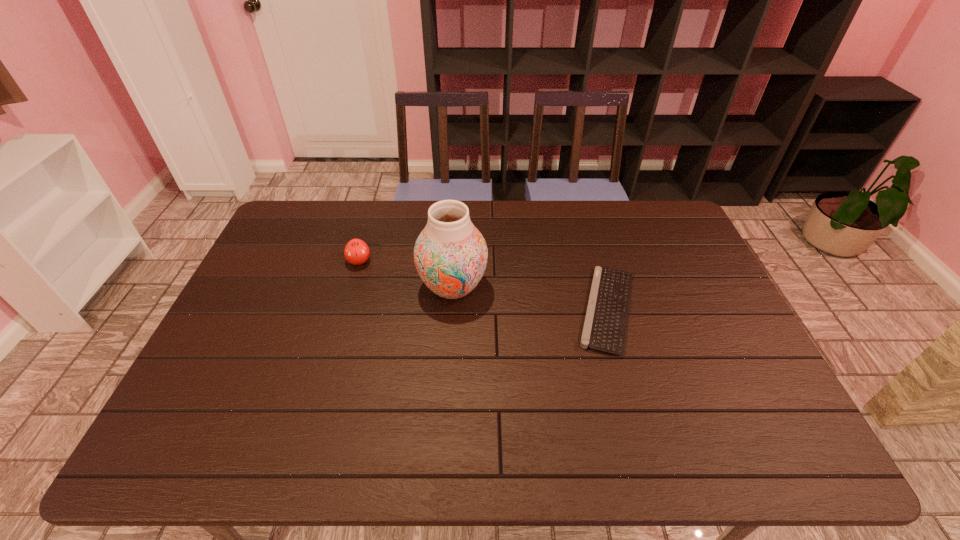
You are a GUI agent. You are given a task and a screenshot of the screen. Output one action in this format:
    pyautogui.click(x=<x>, y=<y>)
    Task: Click on the free space that is in between the tallest object and the second tallest object
    The image size is (960, 540).
    Given the screenshot: What is the action you would take?
    pyautogui.click(x=406, y=274)

Locate an element on the screen. blank region between the rightmost object and the vase is located at coordinates (530, 298).

Locate an element on the screen. vacant space that is in between the tallest object and the rightmost object is located at coordinates (530, 298).

Locate an element on the screen. Image resolution: width=960 pixels, height=540 pixels. vacant space that is in between the second object from right to left and the shortest object is located at coordinates (530, 298).

Locate an element on the screen. The image size is (960, 540). object that stands as the second closest to the apple is located at coordinates (605, 326).

Find the location of a particular element. Image resolution: width=960 pixels, height=540 pixels. object that is the second closest one to the vase is located at coordinates (605, 326).

Image resolution: width=960 pixels, height=540 pixels. What are the coordinates of `vacant position in the image that satisfies the following two spatial constraints: 1. on the front side of the second tallest object; 2. on the left side of the tallest object` in the screenshot? It's located at (351, 287).

Where is `vacant area that satisfies the following two spatial constraints: 1. on the front side of the rightmost object; 2. on the left side of the second object from right to left`? The width and height of the screenshot is (960, 540). vacant area that satisfies the following two spatial constraints: 1. on the front side of the rightmost object; 2. on the left side of the second object from right to left is located at coordinates (451, 309).

This screenshot has height=540, width=960. Identify the location of vacant region that satisfies the following two spatial constraints: 1. on the front side of the apple; 2. on the left side of the rightmost object. (346, 309).